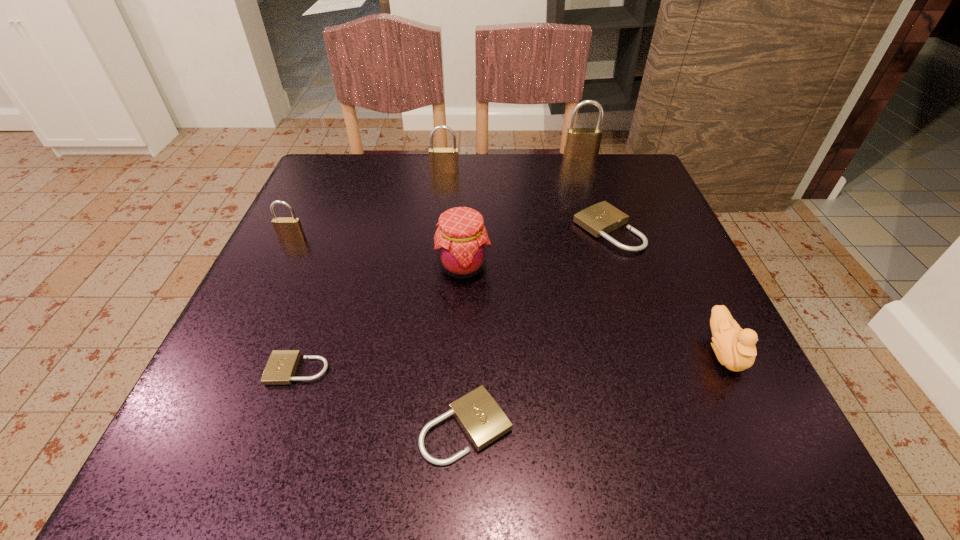
The height and width of the screenshot is (540, 960). Identify the location of the second closest object to the rightmost brass padlock. (442, 160).

Locate which padlock is the fifth closest to the tallest object. Please provide its 2D coordinates. Your answer should be formatted as a tuple, i.e. [(x, y)], where the tuple contains the x and y coordinates of a point satisfying the conditions above.

[(281, 367)]

Identify which padlock is the nearest to the red jam. Please provide its 2D coordinates. Your answer should be formatted as a tuple, i.e. [(x, y)], where the tuple contains the x and y coordinates of a point satisfying the conditions above.

[(602, 218)]

Locate an element on the screen. brass padlock that is the third closest to the duckling is located at coordinates (286, 228).

Identify which brass padlock is the second nearest to the farthest object. Please provide its 2D coordinates. Your answer should be formatted as a tuple, i.e. [(x, y)], where the tuple contains the x and y coordinates of a point satisfying the conditions above.

[(286, 228)]

Locate an element on the screen. beige padlock that stands as the closest to the rightmost beige padlock is located at coordinates (479, 415).

Image resolution: width=960 pixels, height=540 pixels. Identify the location of beige padlock that stands as the second closest to the leftmost padlock. (479, 415).

The height and width of the screenshot is (540, 960). Identify the location of vacant area that satisfies the following two spatial constraints: 1. on the front-facing side of the nearest beige padlock; 2. on the left side of the second farthest padlock. (417, 427).

Identify the location of vacant region that satisfies the following two spatial constraints: 1. on the front-facing side of the second brass padlock from left to right; 2. on the right side of the fourth tallest padlock. (439, 230).